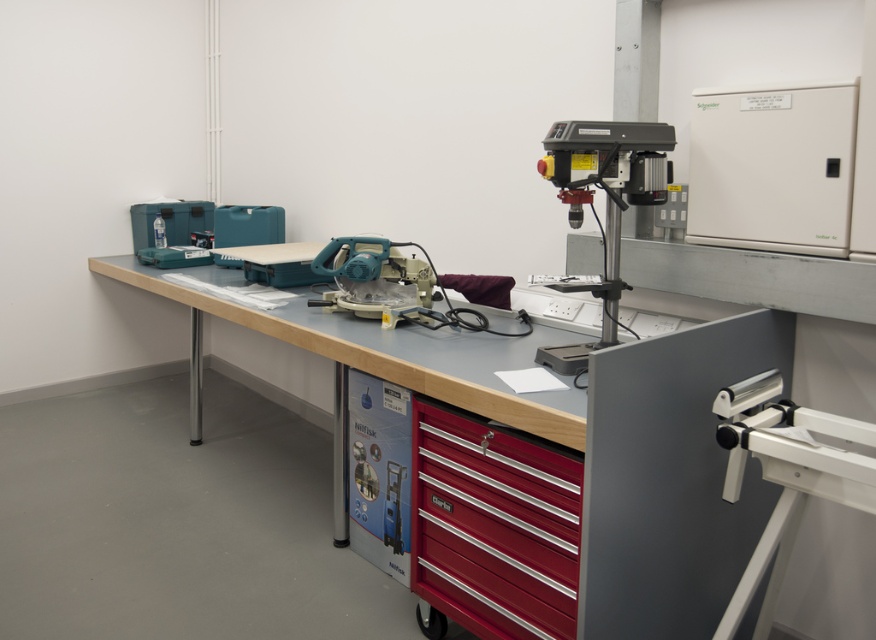
In the workshop scene, you need to locate the metallic gray drill press at upper right and the matte plastic circular saw at center. Which one is positioned to the right of the other?

The metallic gray drill press at upper right is to the right of the matte plastic circular saw at center.

Based on the photo, you are a technician needing to place a 1.2 meter long metal rod horizontally on the workbench. Considering the space between the metallic gray drill press at upper right and the matte plastic circular saw at center, will the rod fit without touching either object?

The metallic gray drill press at upper right is taller than the matte plastic circular saw at center. However, the question is about the horizontal space between them. Since the description only provides information about their heights, not the distance between them, it is impossible to determine if the rod will fit without additional information about the horizontal spacing between the two objects.